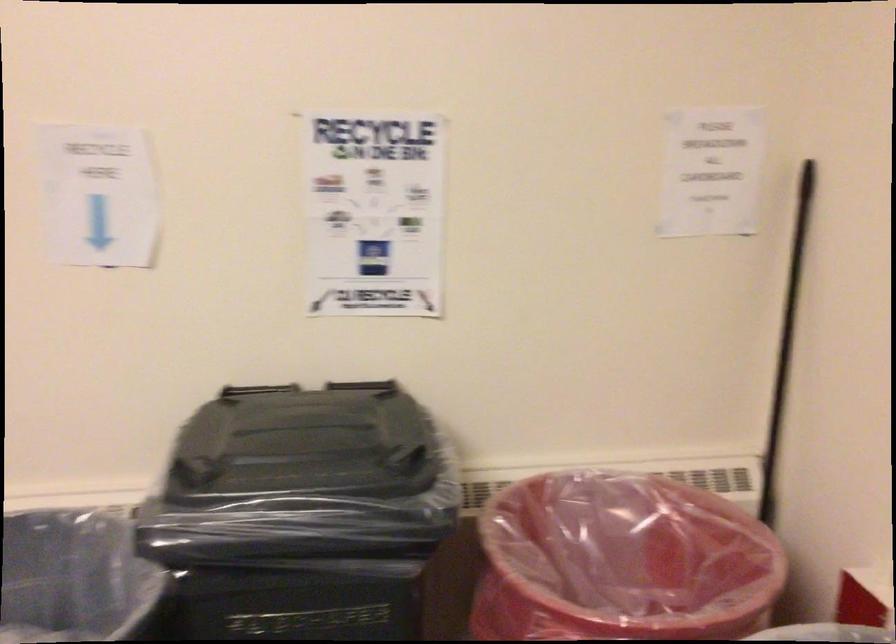
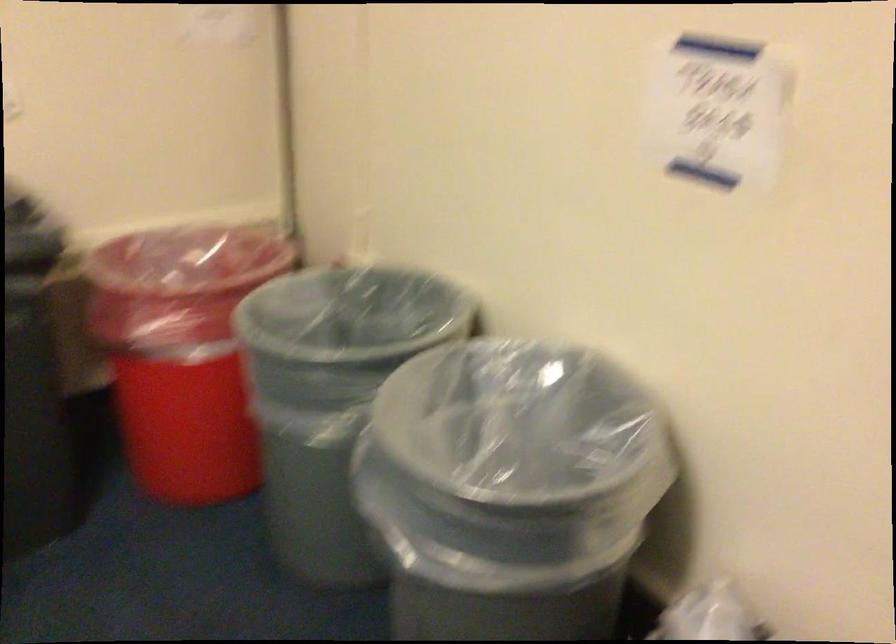
In the second image, find the point that corresponds to point 605,544 in the first image.

(178, 276)